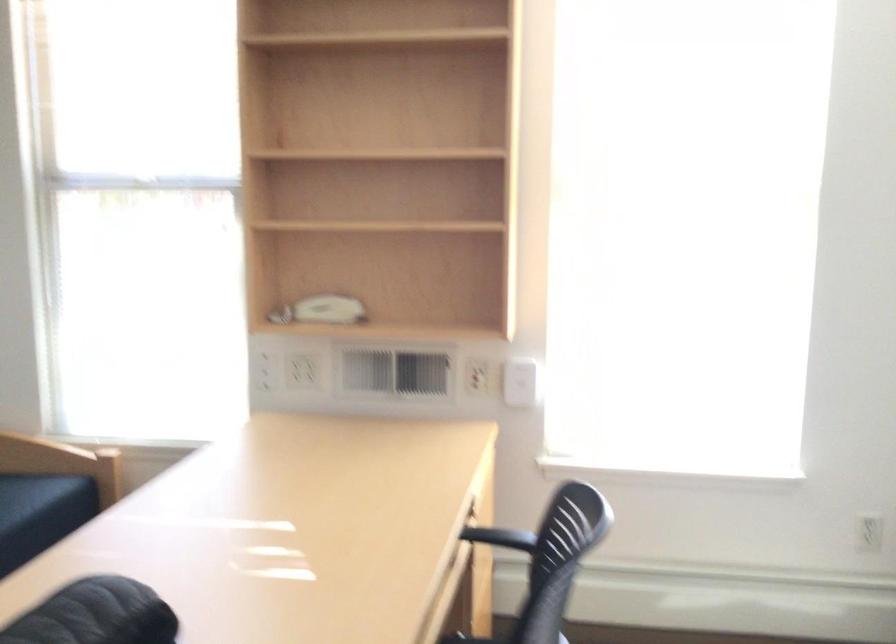
Describe the element at coordinates (324, 314) in the screenshot. I see `the white telephone handset` at that location.